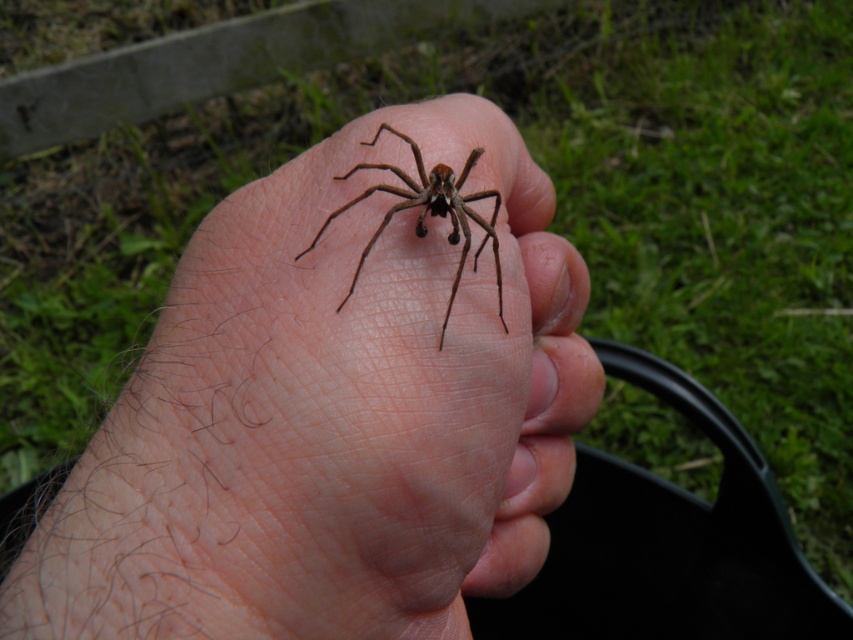
Between brown hairy spider at center and brown fuzzy spider at center, which one has less height?

Standing shorter between the two is brown fuzzy spider at center.

Does brown hairy spider at center have a lesser height compared to brown fuzzy spider at center?

No.

Who is more distant from viewer, (187, 560) or (450, 304)?

Point (450, 304)

Locate an element on the screen. This screenshot has height=640, width=853. brown hairy spider at center is located at coordinates (329, 413).